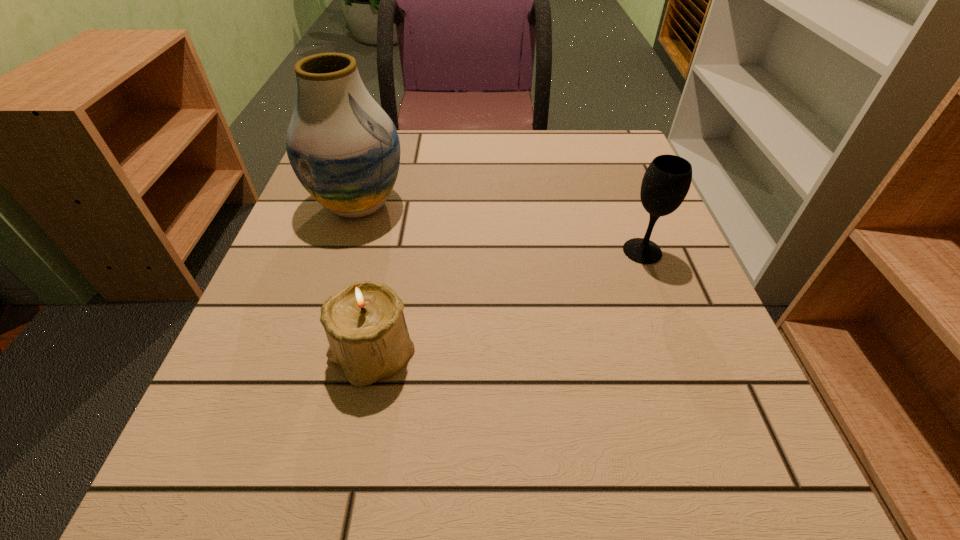
Locate an element on the screen. The image size is (960, 540). free space between the vase and the second nearest object is located at coordinates (500, 228).

The image size is (960, 540). I want to click on vacant area that lies between the shortest object and the wineglass, so click(507, 302).

Locate an element on the screen. free spot between the farthest object and the rightmost object is located at coordinates (500, 228).

I want to click on free point between the second farthest object and the candle_holder, so coord(507,302).

You are a GUI agent. You are given a task and a screenshot of the screen. Output one action in this format:
    pyautogui.click(x=<x>, y=<y>)
    Task: Click on the vacant area between the farthest object and the second nearest object
    The image size is (960, 540).
    Given the screenshot: What is the action you would take?
    pyautogui.click(x=500, y=228)

Find the location of `the closest object to the nearest object`. the closest object to the nearest object is located at coordinates (344, 149).

This screenshot has height=540, width=960. I want to click on object that is the second closest to the farthest object, so click(x=666, y=182).

This screenshot has width=960, height=540. Identify the location of vacant space that satisfies the following two spatial constraints: 1. on the front side of the vase; 2. on the left side of the shortest object. (311, 354).

Where is `free space that satisfies the following two spatial constraints: 1. on the front side of the vase; 2. on the right side of the rightmost object`? The height and width of the screenshot is (540, 960). free space that satisfies the following two spatial constraints: 1. on the front side of the vase; 2. on the right side of the rightmost object is located at coordinates (344, 251).

Where is `vacant space that satisfies the following two spatial constraints: 1. on the back side of the candle_holder; 2. on the right side of the second shortest object`? The height and width of the screenshot is (540, 960). vacant space that satisfies the following two spatial constraints: 1. on the back side of the candle_holder; 2. on the right side of the second shortest object is located at coordinates (393, 251).